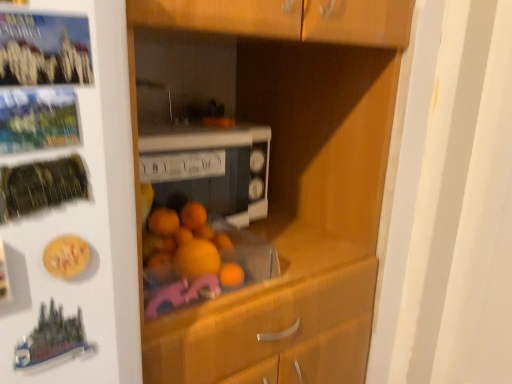
Question: Considering the positions of point click(x=202, y=152) and point click(x=32, y=142), is point click(x=202, y=152) closer or farther from the camera than point click(x=32, y=142)?

Choices:
 (A) farther
 (B) closer

Answer: (A)

Question: Considering their positions, is white glossy microwave at center located in front of or behind metallic silver button at upper left?

Choices:
 (A) behind
 (B) front

Answer: (A)

Question: From the image's perspective, relative to metallic silver button at upper left, is white glossy microwave at center above or below?

Choices:
 (A) above
 (B) below

Answer: (B)

Question: Considering the positions of metallic silver button at upper left and white glossy microwave at center in the image, is metallic silver button at upper left wider or thinner than white glossy microwave at center?

Choices:
 (A) wide
 (B) thin

Answer: (B)

Question: In terms of size, does metallic silver button at upper left appear bigger or smaller than white glossy microwave at center?

Choices:
 (A) big
 (B) small

Answer: (B)

Question: From the image's perspective, is metallic silver button at upper left located above or below white glossy microwave at center?

Choices:
 (A) below
 (B) above

Answer: (B)

Question: Considering the positions of point (14, 129) and point (184, 190), is point (14, 129) closer or farther from the camera than point (184, 190)?

Choices:
 (A) farther
 (B) closer

Answer: (B)